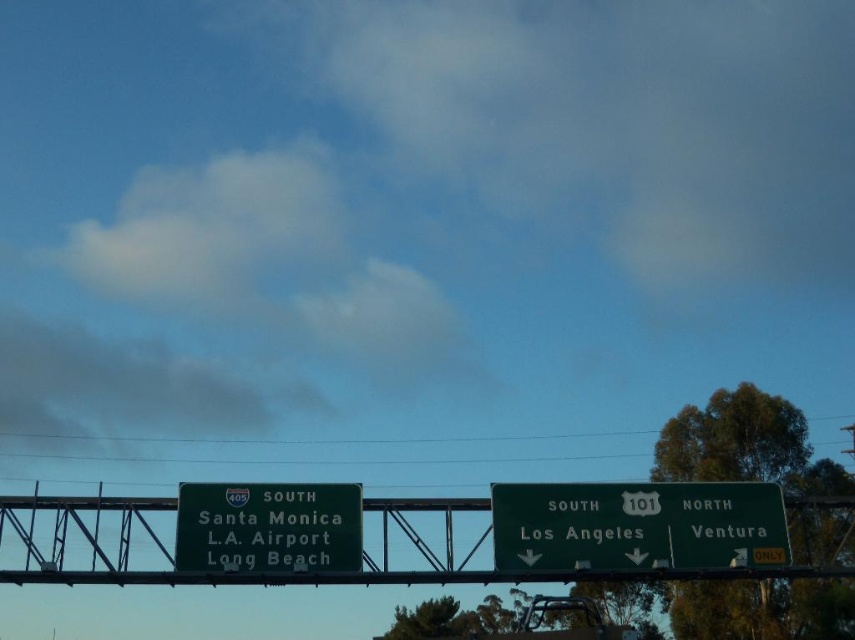
Question: Which point is farther to the camera?

Choices:
 (A) green metallic sign at lower left
 (B) green metallic sign at center

Answer: (A)

Question: Which object is the closest to the green matte sign at center?

Choices:
 (A) green metallic sign at lower left
 (B) green metallic sign at center

Answer: (B)

Question: Considering the relative positions of green metallic sign at center and green matte sign at center in the image provided, where is green metallic sign at center located with respect to green matte sign at center?

Choices:
 (A) above
 (B) below

Answer: (B)

Question: Which object is positioned farthest from the green metallic sign at lower left?

Choices:
 (A) green matte sign at center
 (B) green metallic sign at center

Answer: (B)

Question: Is green matte sign at center positioned at the back of green metallic sign at lower left?

Choices:
 (A) no
 (B) yes

Answer: (B)

Question: Can you confirm if green matte sign at center is thinner than green metallic sign at lower left?

Choices:
 (A) yes
 (B) no

Answer: (B)